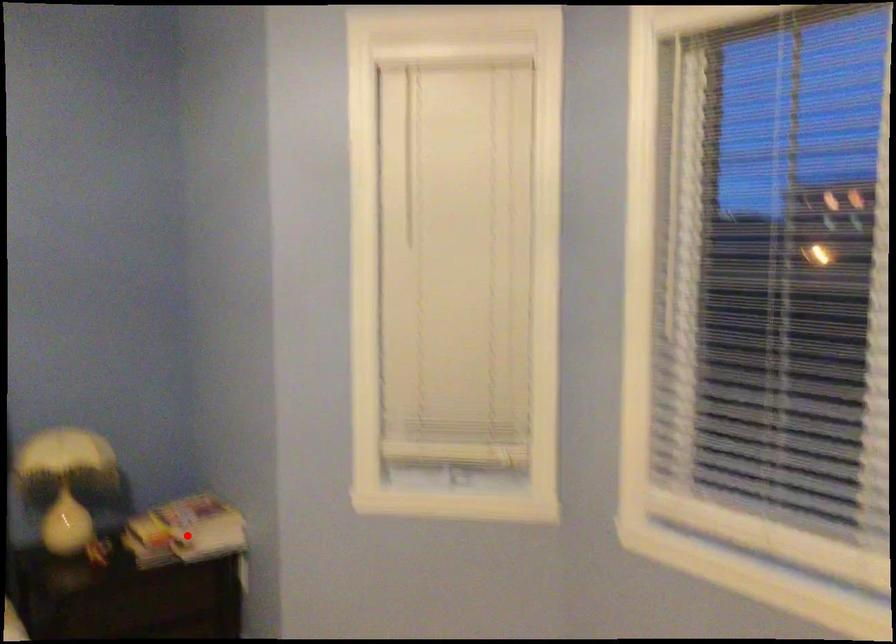
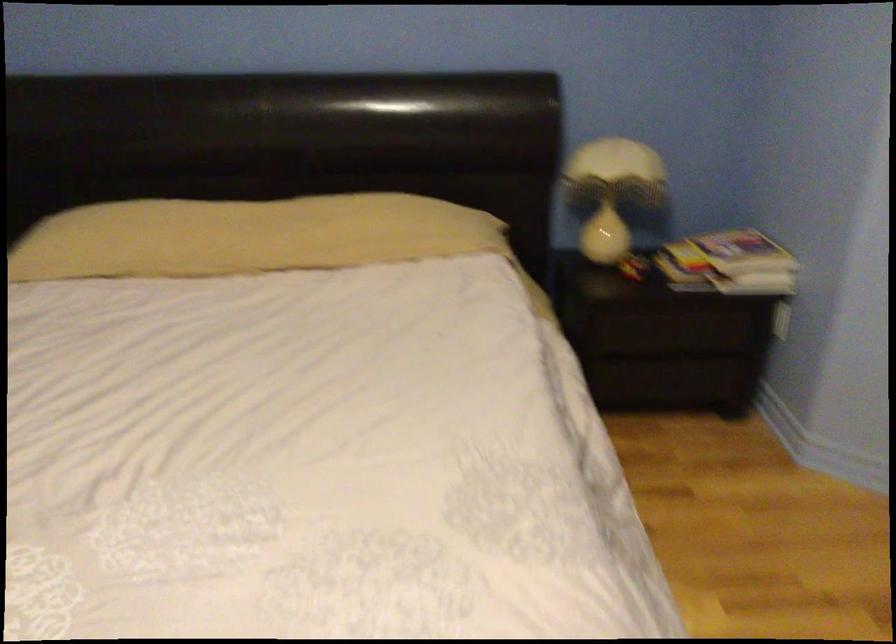
Locate, in the second image, the point that corresponds to the highlighted location in the first image.

(728, 263)